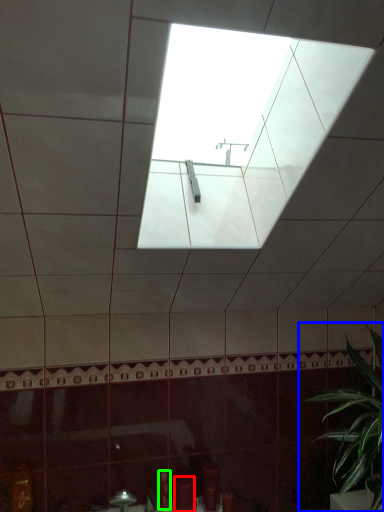
Question: Which object is the farthest from toiletry (highlighted by a red box)? Choose among these: houseplant (highlighted by a blue box) or toiletry (highlighted by a green box).

Choices:
 (A) houseplant
 (B) toiletry

Answer: (A)